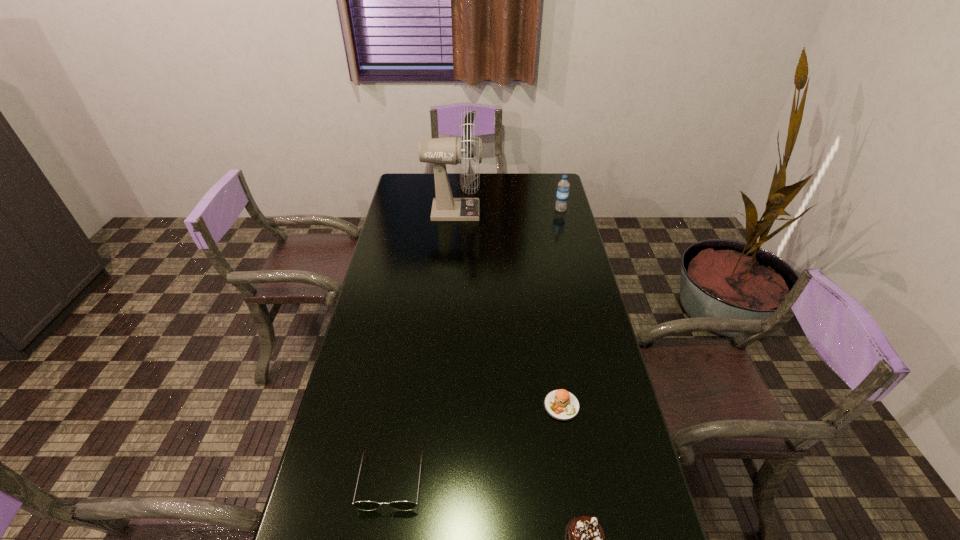
Locate an element on the screen. This screenshot has width=960, height=540. object that is at the far edge is located at coordinates (441, 151).

I want to click on fan present at the left edge, so click(x=441, y=151).

Locate an element on the screen. sunglasses at the left edge is located at coordinates (361, 505).

Where is `water bottle present at the right edge`? water bottle present at the right edge is located at coordinates (563, 189).

I want to click on patty that is at the right edge, so click(x=560, y=404).

Find the location of `object that is at the far left corner`. object that is at the far left corner is located at coordinates (441, 151).

In order to click on free region at the far edge of the desktop in this screenshot , I will do `click(516, 184)`.

In the image, there is a desktop. Where is `free space at the left edge`? free space at the left edge is located at coordinates (413, 292).

Find the location of `vacant space at the right edge of the desktop`. vacant space at the right edge of the desktop is located at coordinates (586, 298).

This screenshot has width=960, height=540. What are the coordinates of `vacant space at the far left corner` in the screenshot? It's located at (420, 193).